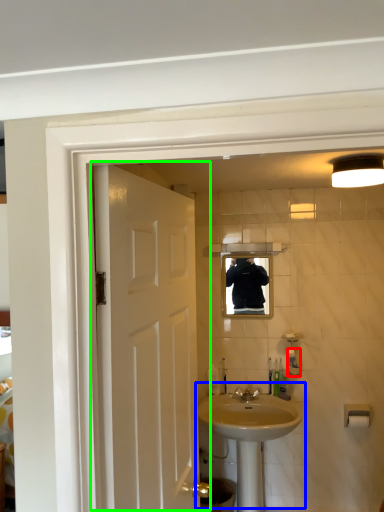
Question: Which object is positioned closest to toiletry (highlighted by a red box)? Select from sink (highlighted by a blue box) and door (highlighted by a green box).

Choices:
 (A) sink
 (B) door

Answer: (A)